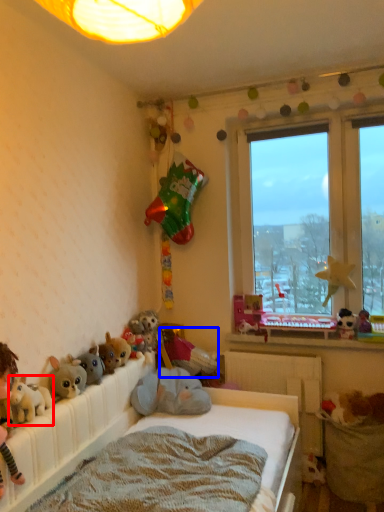
Question: Among these objects, which one is farthest to the camera, toy (highlighted by a red box) or toy (highlighted by a blue box)?

Choices:
 (A) toy
 (B) toy

Answer: (B)